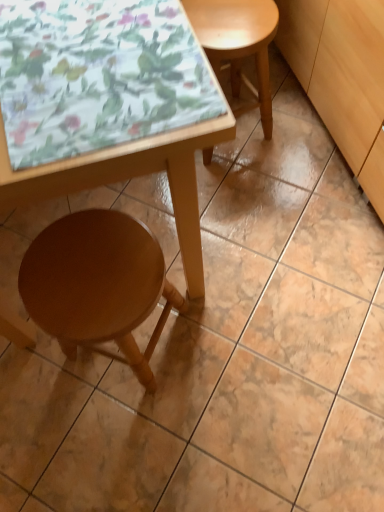
Locate an element on the screen. This screenshot has height=512, width=384. vacant space to the left of wooden stool at lower left, which ranks as the second stool in top-to-bottom order is located at coordinates (22, 361).